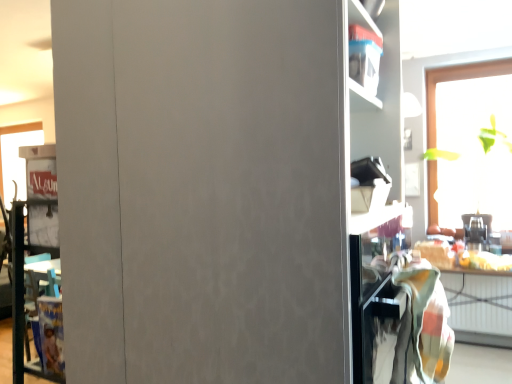
Question: Considering the positions of metallic silver toaster at right and multicolored woven blanket at right in the image, is metallic silver toaster at right wider or thinner than multicolored woven blanket at right?

Choices:
 (A) thin
 (B) wide

Answer: (A)

Question: Is metallic silver toaster at right in front of or behind multicolored woven blanket at right in the image?

Choices:
 (A) behind
 (B) front

Answer: (A)

Question: Which of these objects is positioned closest to the wooden table at lower right?

Choices:
 (A) matte gray cabinet at center
 (B) transparent glass window at upper right
 (C) multicolored woven blanket at right
 (D) metallic silver toaster at right

Answer: (D)

Question: Which object is positioned farthest from the wooden table at lower right?

Choices:
 (A) transparent glass window at upper right
 (B) multicolored woven blanket at right
 (C) metallic silver toaster at right
 (D) matte gray cabinet at center

Answer: (D)